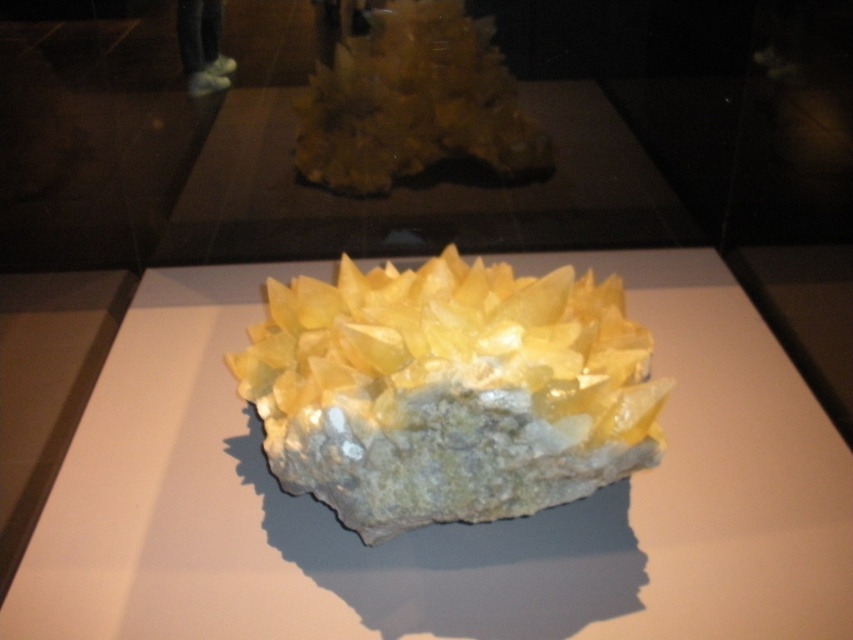
You are a geologist examining the mineral specimens in the museum. You need to locate the translucent yellow crystal at center. What are its coordinates?

The translucent yellow crystal at center is located at coordinates point (445, 525).

You are a geologist examining the mineral specimen displayed on the light surface. You notice a point labeled at coordinates (x=445, y=525). Which part of the mineral does this point correspond to?

The point labeled at coordinates (x=445, y=525) corresponds to the translucent yellow crystal at center.